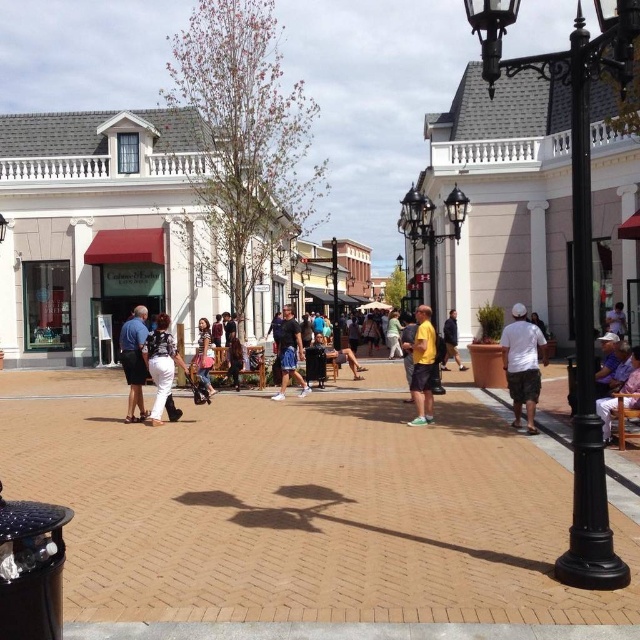
Question: Which of the following is the closest to the observer?

Choices:
 (A) black wrought iron streetlight at center
 (B) black wrought iron lamp post at right
 (C) yellow matte shirt at center
 (D) light blue shirt at center

Answer: (B)

Question: Which point appears farthest from the camera in this image?

Choices:
 (A) (637, 372)
 (B) (609, 570)
 (C) (198, 348)
 (D) (122, 497)

Answer: (C)

Question: Is black wrought iron lamp post at right to the right of light blue shirt at center from the viewer's perspective?

Choices:
 (A) yes
 (B) no

Answer: (A)

Question: Does black wrought iron lamp post at right have a greater width compared to purple fabric chair at lower right?

Choices:
 (A) no
 (B) yes

Answer: (B)

Question: Does white matte shirt at right come in front of light blue shirt at center?

Choices:
 (A) yes
 (B) no

Answer: (A)

Question: Which of the following is the closest to the observer?

Choices:
 (A) white matte shirt at right
 (B) denim skirt at center
 (C) black wrought iron lamp post at right
 (D) purple fabric chair at lower right

Answer: (C)